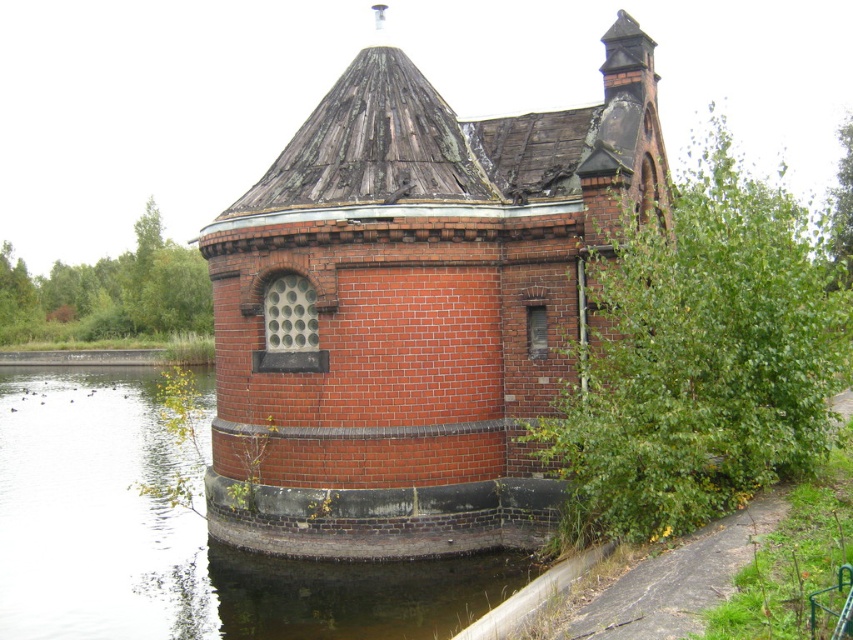
Which is below, red brick tower at center or clear water at lower left?

clear water at lower left is below.

Is red brick tower at center below clear water at lower left?

No.

Is point (338, 276) farther from camera compared to point (292, 593)?

That is True.

This screenshot has width=853, height=640. Identify the location of red brick tower at center. (412, 308).